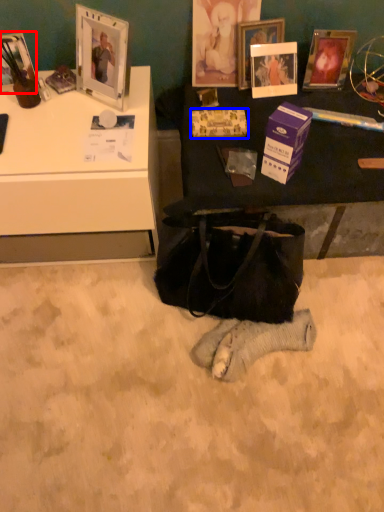
Question: Which object is closer to the camera taking this photo, picture frame (highlighted by a red box) or paperback book (highlighted by a blue box)?

Choices:
 (A) picture frame
 (B) paperback book

Answer: (A)